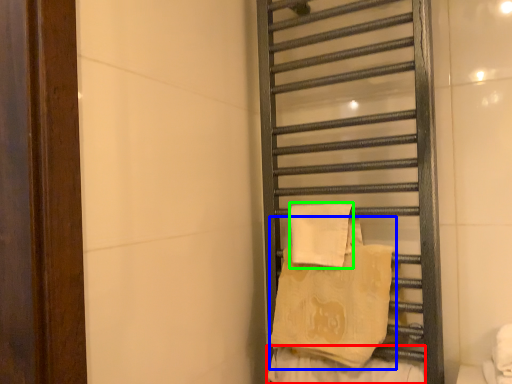
Question: Which object is the farthest from material (highlighted by a red box)? Choose among these: beach towel (highlighted by a blue box) or beach towel (highlighted by a green box).

Choices:
 (A) beach towel
 (B) beach towel

Answer: (B)